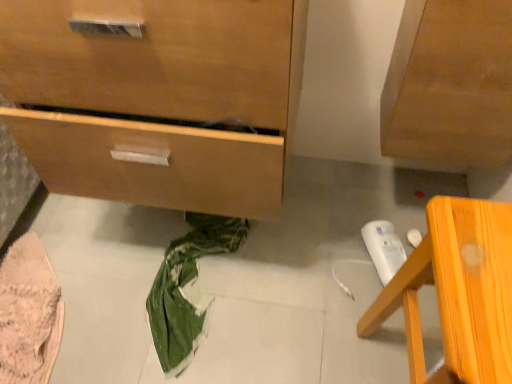
Question: From a real-world perspective, is orange wood chair at lower right physically above pink knitted fabric at lower left?

Choices:
 (A) no
 (B) yes

Answer: (B)

Question: Considering the relative sizes of orange wood chair at lower right and pink knitted fabric at lower left in the image provided, is orange wood chair at lower right taller than pink knitted fabric at lower left?

Choices:
 (A) no
 (B) yes

Answer: (B)

Question: Are orange wood chair at lower right and pink knitted fabric at lower left making contact?

Choices:
 (A) yes
 (B) no

Answer: (B)

Question: Considering the relative sizes of orange wood chair at lower right and pink knitted fabric at lower left in the image provided, is orange wood chair at lower right shorter than pink knitted fabric at lower left?

Choices:
 (A) no
 (B) yes

Answer: (A)

Question: Are orange wood chair at lower right and pink knitted fabric at lower left far apart?

Choices:
 (A) no
 (B) yes

Answer: (A)

Question: Does orange wood chair at lower right have a lesser width compared to pink knitted fabric at lower left?

Choices:
 (A) no
 (B) yes

Answer: (B)

Question: Is the depth of pink knitted fabric at lower left greater than that of wooden chest of drawers at lower left?

Choices:
 (A) no
 (B) yes

Answer: (B)

Question: Can we say pink knitted fabric at lower left lies outside wooden chest of drawers at lower left?

Choices:
 (A) yes
 (B) no

Answer: (A)

Question: Does pink knitted fabric at lower left turn towards wooden chest of drawers at lower left?

Choices:
 (A) no
 (B) yes

Answer: (A)

Question: From the image's perspective, is pink knitted fabric at lower left on wooden chest of drawers at lower left?

Choices:
 (A) no
 (B) yes

Answer: (A)

Question: Considering the relative positions of pink knitted fabric at lower left and wooden chest of drawers at lower left in the image provided, is pink knitted fabric at lower left in front of wooden chest of drawers at lower left?

Choices:
 (A) yes
 (B) no

Answer: (B)

Question: Can you confirm if pink knitted fabric at lower left is smaller than wooden chest of drawers at lower left?

Choices:
 (A) no
 (B) yes

Answer: (B)

Question: Could you tell me if orange wood chair at lower right is turned towards wooden chest of drawers at lower left?

Choices:
 (A) yes
 (B) no

Answer: (B)